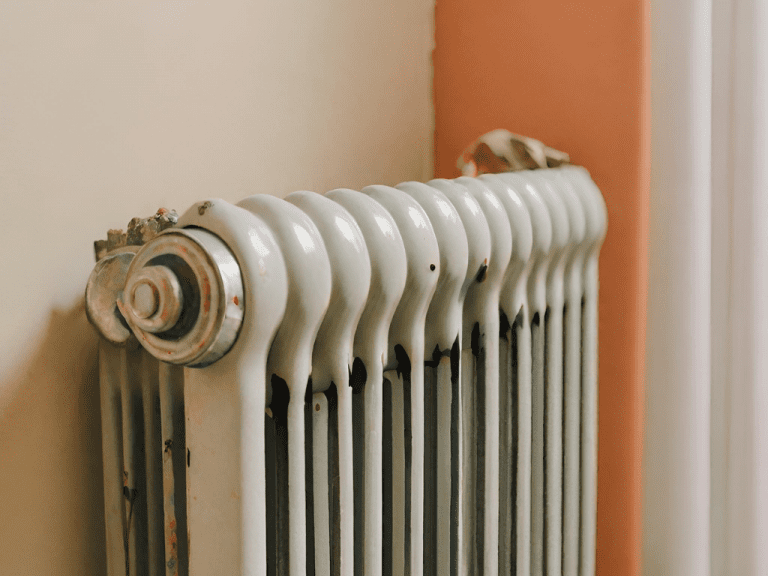
You are a GUI agent. You are given a task and a screenshot of the screen. Output one action in this format:
    pyautogui.click(x=<x>, y=<y>)
    Task: Click on the curtain
    
    Given the screenshot: What is the action you would take?
    pyautogui.click(x=644, y=125)